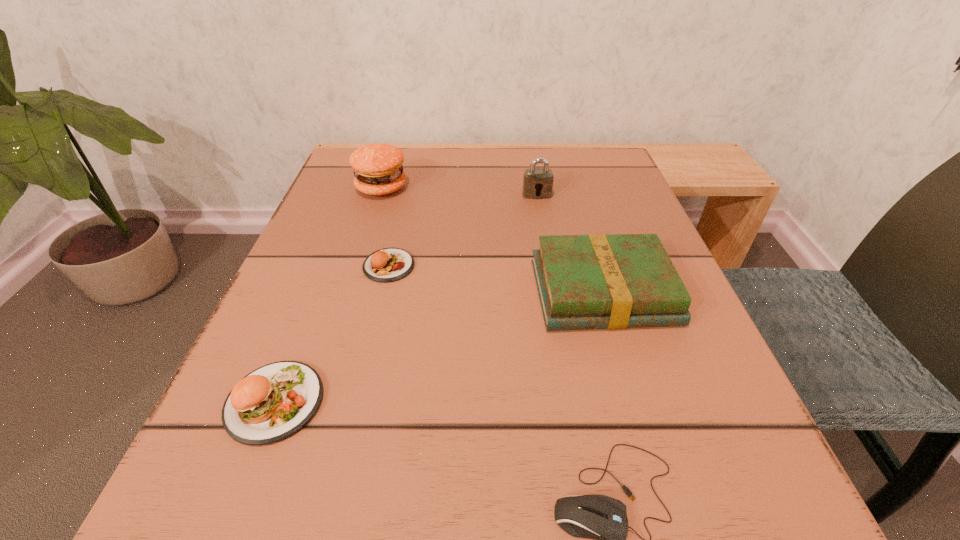
Find the location of a particular element. The width and height of the screenshot is (960, 540). the third closest object to the farthest patty (food) is located at coordinates pos(596,281).

What are the coordinates of `patty (food) that is the second closest to the fourth shortest object` in the screenshot? It's located at (271, 403).

Identify which patty (food) is the second nearest to the computer mouse. Please provide its 2D coordinates. Your answer should be formatted as a tuple, i.e. [(x, y)], where the tuple contains the x and y coordinates of a point satisfying the conditions above.

[(388, 264)]

Where is `free point that satisfies the following two spatial constraints: 1. on the front side of the fourth shortest object; 2. on the left side of the farthest patty (food)`? The image size is (960, 540). free point that satisfies the following two spatial constraints: 1. on the front side of the fourth shortest object; 2. on the left side of the farthest patty (food) is located at coordinates (348, 292).

This screenshot has width=960, height=540. In order to click on vacant position in the image that satisfies the following two spatial constraints: 1. on the front side of the shortest patty (food); 2. on the right side of the third tallest object in this screenshot , I will do `click(383, 292)`.

The height and width of the screenshot is (540, 960). Find the location of `free region that satisfies the following two spatial constraints: 1. on the front side of the book; 2. on the right side of the farthest patty (food)`. free region that satisfies the following two spatial constraints: 1. on the front side of the book; 2. on the right side of the farthest patty (food) is located at coordinates (348, 292).

Identify the location of vacant space that satisfies the following two spatial constraints: 1. at the front of the padlock near the keyhole; 2. on the right side of the third tallest object. (554, 292).

What are the coordinates of `free spot that satisfies the following two spatial constraints: 1. at the front of the book near the keyhole; 2. on the left side of the padlock` in the screenshot? It's located at (554, 292).